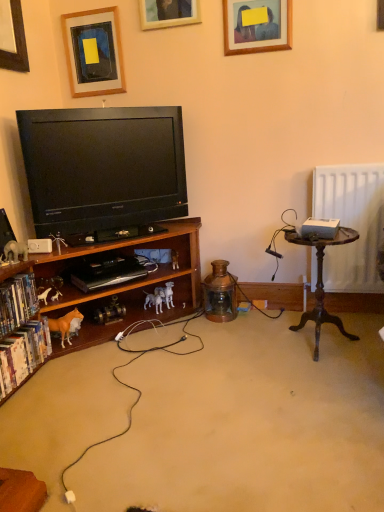
Identify the location of free space between hardcover book at lower left, which is the first book from bottom to top, and copper glass lantern at center, the second toy when ordered from back to front. The height and width of the screenshot is (512, 384). (141, 347).